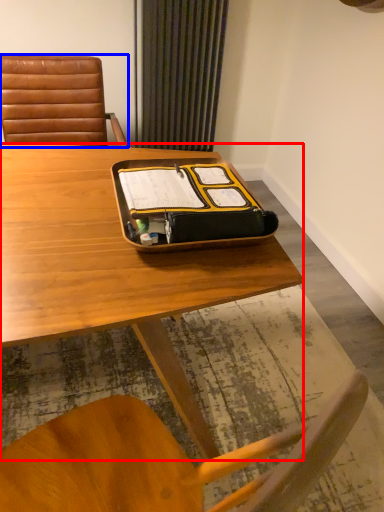
Question: Which object appears farthest to the camera in this image, desk (highlighted by a red box) or chair (highlighted by a blue box)?

Choices:
 (A) desk
 (B) chair

Answer: (B)